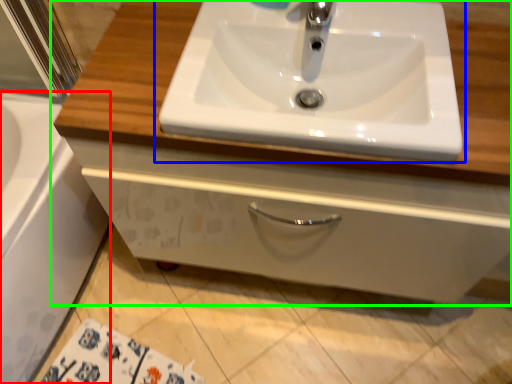
Question: Which object is the closest to the bath (highlighted by a red box)? Choose among these: sink (highlighted by a blue box) or bathroom cabinet (highlighted by a green box).

Choices:
 (A) sink
 (B) bathroom cabinet

Answer: (B)